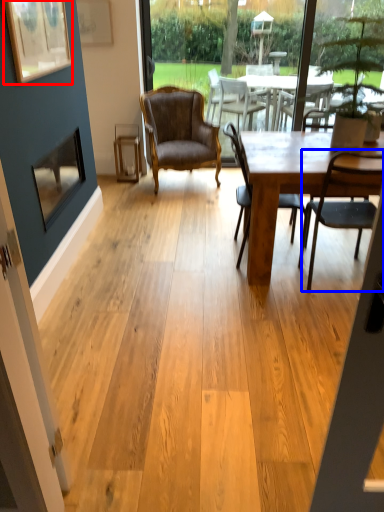
Question: Among these objects, which one is farthest to the camera, picture frame (highlighted by a red box) or chair (highlighted by a blue box)?

Choices:
 (A) picture frame
 (B) chair

Answer: (B)